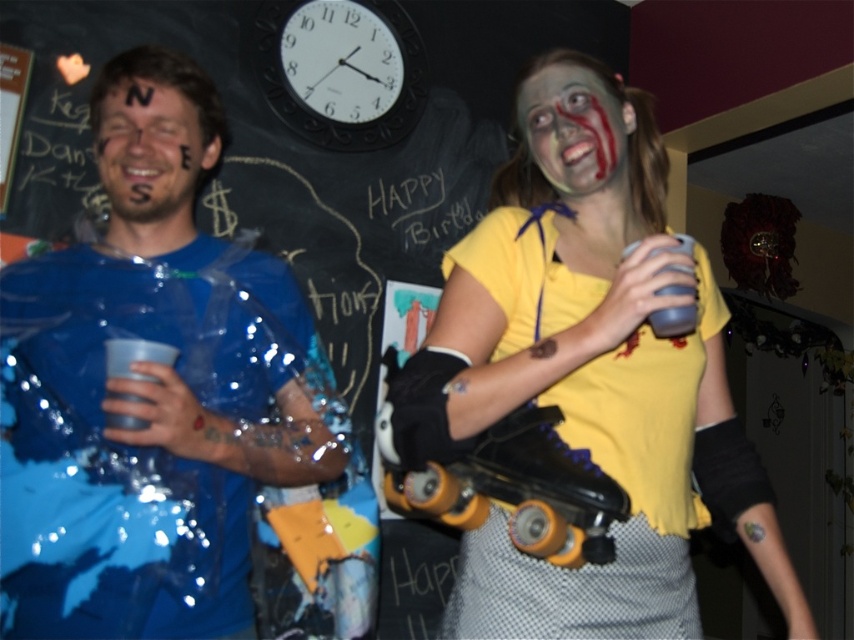
Is yellow rubber roller skate at center shorter than matte white face at upper right?

No, yellow rubber roller skate at center is not shorter than matte white face at upper right.

Describe the element at coordinates (515, 488) in the screenshot. This screenshot has height=640, width=854. I see `yellow rubber roller skate at center` at that location.

Does point (529, 493) come behind point (601, 122)?

No, (529, 493) is in front of (601, 122).

Find the location of a particular element. yellow rubber roller skate at center is located at coordinates (515, 488).

Consider the image. Which is below, yellow matte shirt at upper right or matte white face at upper right?

yellow matte shirt at upper right

Between point (553, 358) and point (571, 92), which one is positioned behind?

Point (571, 92)

Which is behind, point (624, 371) or point (588, 125)?

The point (588, 125) is behind.

Where is `yellow matte shirt at upper right`? This screenshot has width=854, height=640. yellow matte shirt at upper right is located at coordinates (588, 372).

Between point (279, 392) and point (132, 211), which one is positioned in front?

Point (132, 211)

Is blue shiny plastic cup at left taller than matte blue face at center?

Indeed, blue shiny plastic cup at left has a greater height compared to matte blue face at center.

Describe the element at coordinates (139, 486) in the screenshot. The width and height of the screenshot is (854, 640). I see `blue shiny plastic cup at left` at that location.

You are a GUI agent. You are given a task and a screenshot of the screen. Output one action in this format:
    pyautogui.click(x=<x>, y=<y>)
    Task: Click on the blue shiny plastic cup at left
    
    Given the screenshot: What is the action you would take?
    pyautogui.click(x=139, y=486)